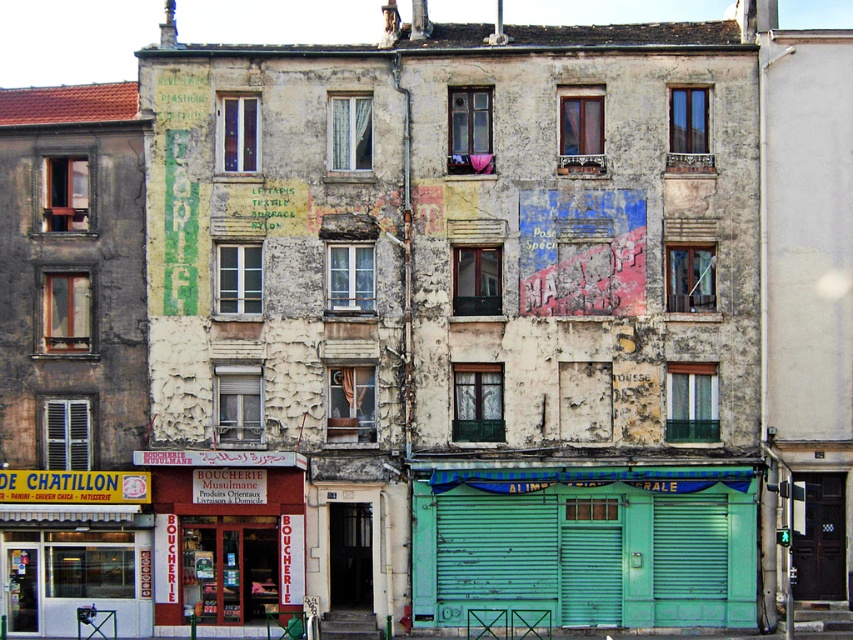
You are a delivery person with a cart that is 2 meters wide. You need to navigate between the red brick boucherie at lower left and the green metallic shutter at lower center to reach the alley behind them. Can your cart fit through the space between them?

The red brick boucherie at lower left and the green metallic shutter at lower center are 6.65 meters apart from each other. Since your cart is 2 meters wide, it can easily fit through the space between them as the distance is more than sufficient.

You are standing at the entrance of the building and want to find the red brick boucherie at lower left. Based on the coordinates provided, in which direction should you move relative to your current position?

The red brick boucherie at lower left is located at coordinates point (225, 532). Since you are at the entrance, which is likely at the lower part of the building, moving towards the left side would lead you to the red brick boucherie at lower left.